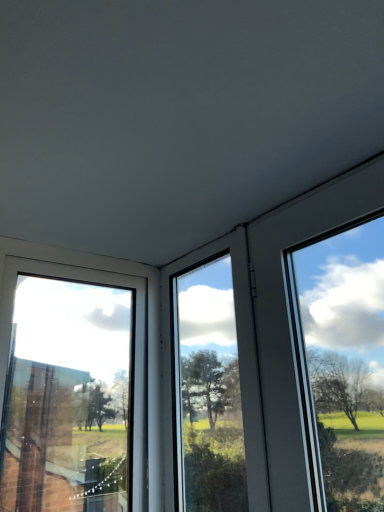
Question: Considering their positions, is transparent glass window at left, marked as the first window in a left-to-right arrangement, located in front of or behind transparent glass window at center, arranged as the 2th window when viewed from the left?

Choices:
 (A) front
 (B) behind

Answer: (A)

Question: Is transparent glass window at left, marked as the first window in a left-to-right arrangement, wider or thinner than transparent glass window at center, arranged as the 2th window when viewed from the left?

Choices:
 (A) wide
 (B) thin

Answer: (A)

Question: From the image's perspective, is transparent glass window at left, marked as the first window in a left-to-right arrangement, positioned above or below transparent glass window at center, arranged as the 2th window when viewed from the left?

Choices:
 (A) below
 (B) above

Answer: (A)

Question: Considering the positions of transparent glass window at center, arranged as the 2th window when viewed from the left, and transparent glass window at left, marked as the first window in a left-to-right arrangement, in the image, is transparent glass window at center, arranged as the 2th window when viewed from the left, wider or thinner than transparent glass window at left, marked as the first window in a left-to-right arrangement,?

Choices:
 (A) wide
 (B) thin

Answer: (B)

Question: Is transparent glass window at center, placed as the first window when sorted from right to left, in front of or behind transparent glass window at left, which ranks as the second window in right-to-left order, in the image?

Choices:
 (A) behind
 (B) front

Answer: (A)

Question: Visually, is transparent glass window at center, arranged as the 2th window when viewed from the left, positioned to the left or to the right of transparent glass window at left, marked as the first window in a left-to-right arrangement?

Choices:
 (A) left
 (B) right

Answer: (B)

Question: From the image's perspective, is transparent glass window at center, arranged as the 2th window when viewed from the left, positioned above or below transparent glass window at left, marked as the first window in a left-to-right arrangement?

Choices:
 (A) below
 (B) above

Answer: (B)